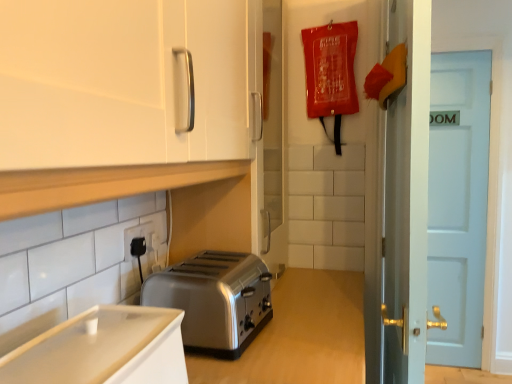
Question: Considering the relative positions of white wooden door at right and satin silver toaster at lower center in the image provided, is white wooden door at right to the left or to the right of satin silver toaster at lower center?

Choices:
 (A) right
 (B) left

Answer: (A)

Question: Is white wooden door at right wider or thinner than satin silver toaster at lower center?

Choices:
 (A) wide
 (B) thin

Answer: (B)

Question: Which of these objects is positioned closest to the satin silver toaster at lower center?

Choices:
 (A) white wooden door at right
 (B) white glossy cabinet at upper left, which is the 1th cabinetry from top to bottom
 (C) white glossy cabinet at lower left, the second cabinetry viewed from the top
 (D) black plastic electric outlet at lower left

Answer: (D)

Question: Which object is the closest to the white glossy cabinet at upper left, which is the 1th cabinetry from top to bottom?

Choices:
 (A) satin silver toaster at lower center
 (B) white glossy cabinet at lower left, the second cabinetry viewed from the top
 (C) black plastic electric outlet at lower left
 (D) white wooden door at right

Answer: (B)